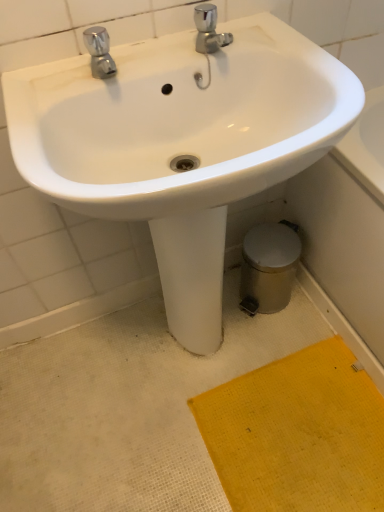
Question: Is yellow textured mat at lower right positioned beyond the bounds of white glossy sink at center?

Choices:
 (A) no
 (B) yes

Answer: (B)

Question: Is yellow textured mat at lower right shorter than white glossy sink at center?

Choices:
 (A) yes
 (B) no

Answer: (A)

Question: Could you tell me if yellow textured mat at lower right is facing white glossy sink at center?

Choices:
 (A) yes
 (B) no

Answer: (B)

Question: Is yellow textured mat at lower right closer to camera compared to white glossy sink at center?

Choices:
 (A) no
 (B) yes

Answer: (A)

Question: Is yellow textured mat at lower right placed right next to white glossy sink at center?

Choices:
 (A) no
 (B) yes

Answer: (A)

Question: From a real-world perspective, is yellow textured mat at lower right physically above white glossy sink at center?

Choices:
 (A) no
 (B) yes

Answer: (A)

Question: Is white glossy sink at center oriented towards polished chrome faucet at upper left?

Choices:
 (A) no
 (B) yes

Answer: (A)

Question: Does white glossy sink at center lie in front of polished chrome faucet at upper left?

Choices:
 (A) no
 (B) yes

Answer: (B)

Question: Is white glossy sink at center to the right of polished chrome faucet at upper left from the viewer's perspective?

Choices:
 (A) no
 (B) yes

Answer: (B)

Question: Is white glossy sink at center thinner than polished chrome faucet at upper left?

Choices:
 (A) yes
 (B) no

Answer: (B)

Question: Considering the relative positions of white glossy sink at center and polished chrome faucet at upper left in the image provided, is white glossy sink at center to the left of polished chrome faucet at upper left from the viewer's perspective?

Choices:
 (A) yes
 (B) no

Answer: (B)

Question: Is white glossy sink at center placed right next to polished chrome faucet at upper left?

Choices:
 (A) no
 (B) yes

Answer: (A)

Question: From the image's perspective, is white glossy sink at center below yellow textured mat at lower right?

Choices:
 (A) no
 (B) yes

Answer: (A)